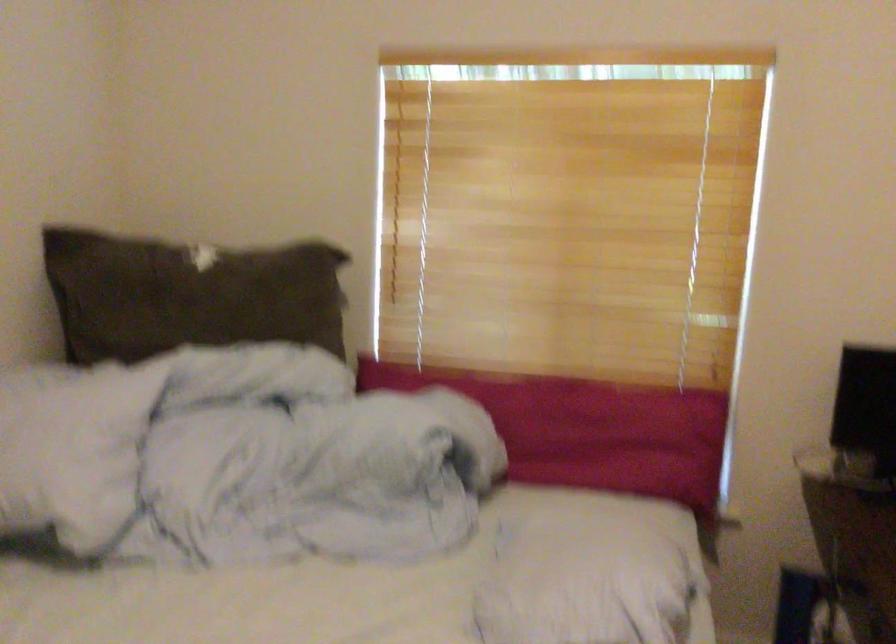
Question: The camera is either moving clockwise (left) or counter-clockwise (right) around the object. The first image is from the beginning of the video and the second image is from the end. Is the camera moving left or right when shooting the video?

Choices:
 (A) Left
 (B) Right

Answer: (A)